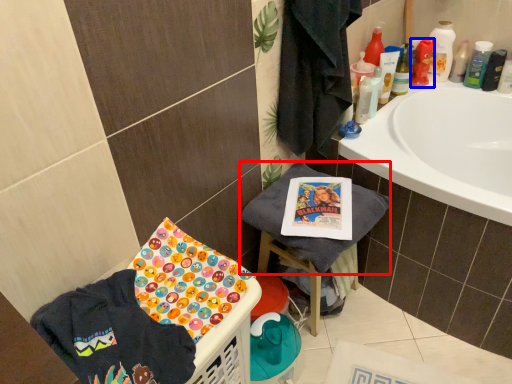
Question: Which of the following is the closest to the observer, beach towel (highlighted by a red box) or mouthwash (highlighted by a blue box)?

Choices:
 (A) beach towel
 (B) mouthwash

Answer: (A)